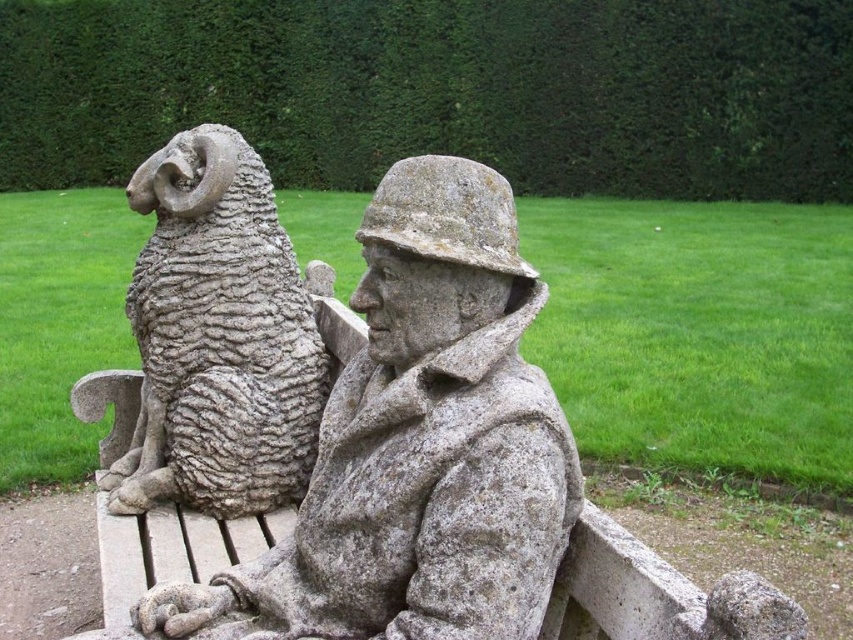
You are an art curator planning to display the granite statue at center and the gray stone ram at left in a gallery. Given their heights, which one should be placed on a higher pedestal to ensure both are visible to visitors?

The gray stone ram at left should be placed on a lower pedestal because the granite statue at center is shorter. This way, both will be at a similar viewing height for visitors.

You are standing in front of the stone sculpture of the ram and the man. You notice two points marked on the image at coordinates point (x=546, y=490) and point (x=161, y=484). Which point is closer to you?

Point (x=546, y=490) is in front of point (x=161, y=484), so it is closer to you.